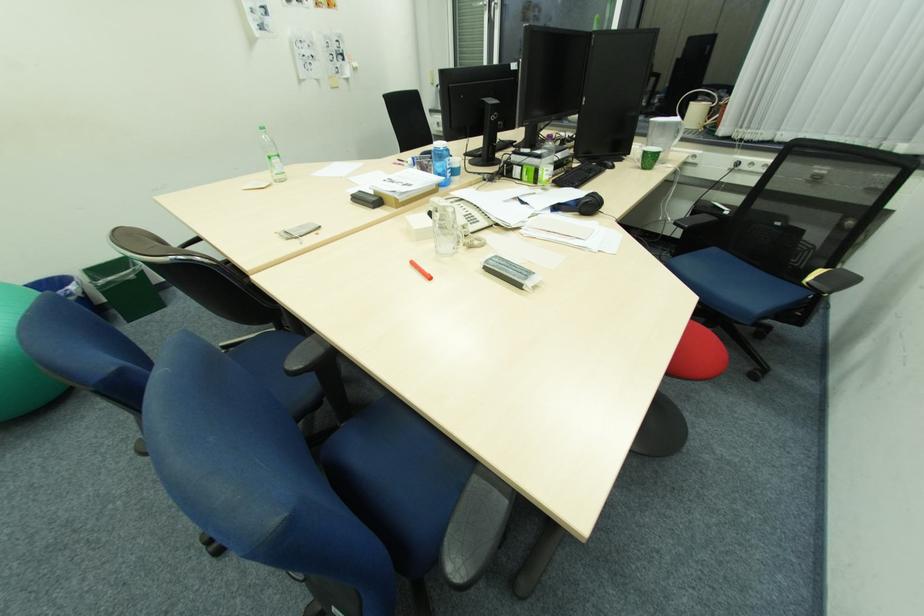
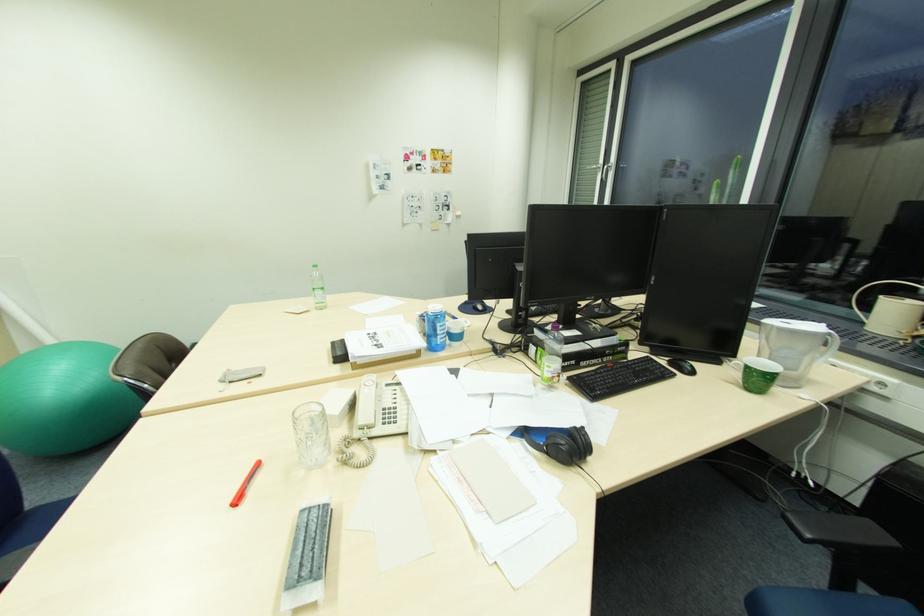
Question: The images are taken continuously from a first-person perspective. In which direction is your viewpoint rotating?

Choices:
 (A) Left
 (B) Right
 (C) Up
 (D) Down

Answer: (A)